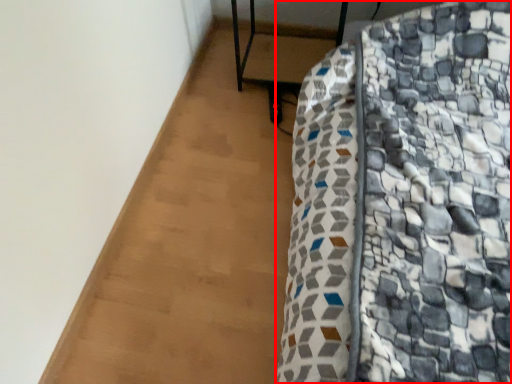
Question: In this image, where is furniture (annotated by the red box) located relative to furniture?

Choices:
 (A) right
 (B) left

Answer: (A)